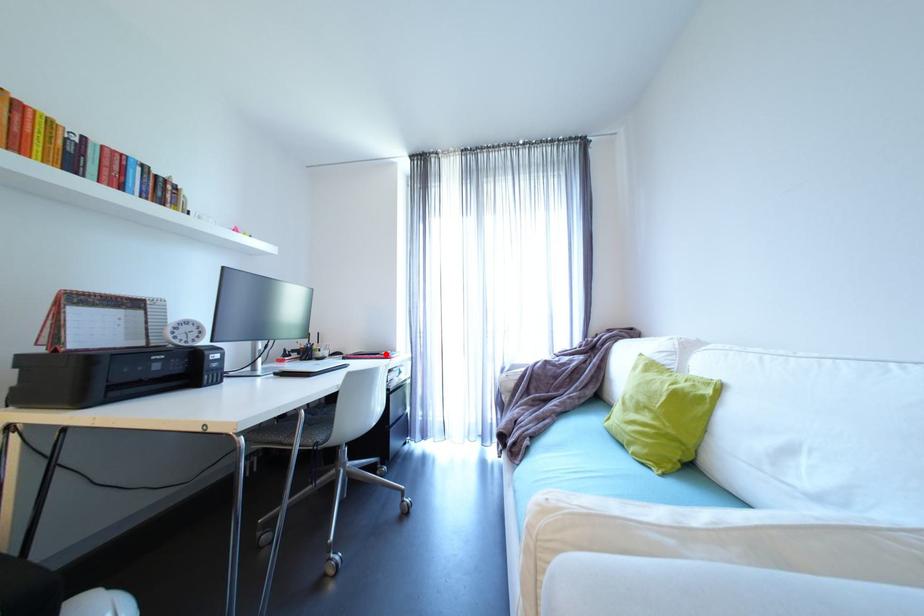
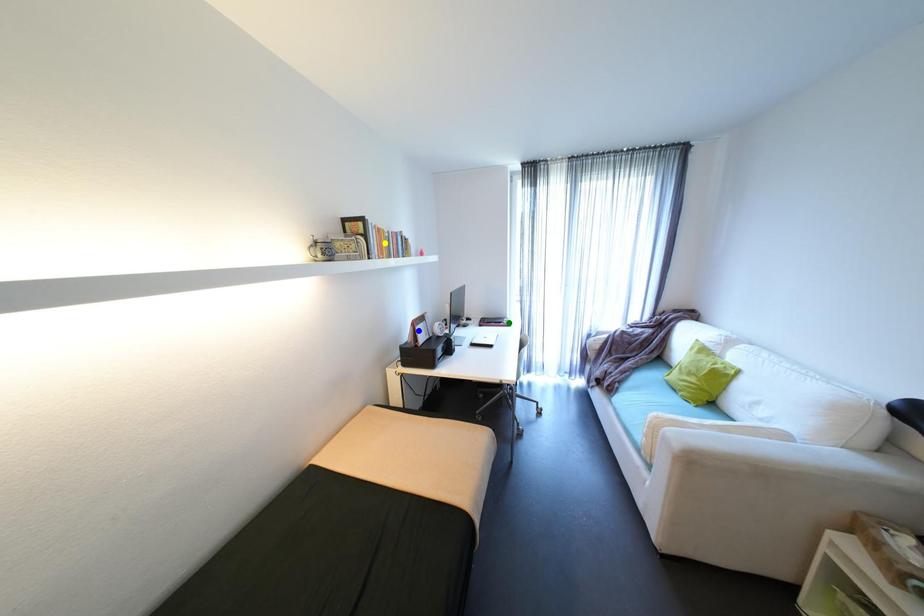
Question: I am providing you with two images of the same scene from different viewpoints. A red point is marked on the first image. You are given multiple points on the second image. Which mark in image 2 goes with the point in image 1?

Choices:
 (A) yellow point
 (B) blue point
 (C) green point

Answer: (C)